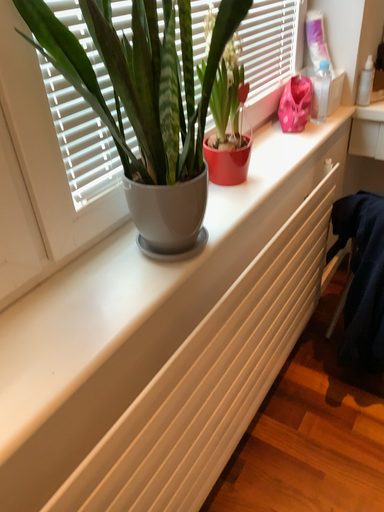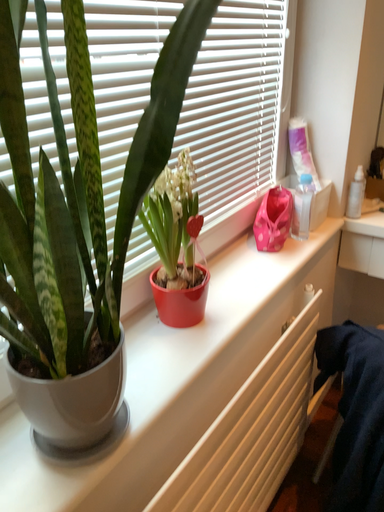
Question: How did the camera likely rotate when shooting the video?

Choices:
 (A) rotated downward
 (B) rotated upward

Answer: (B)